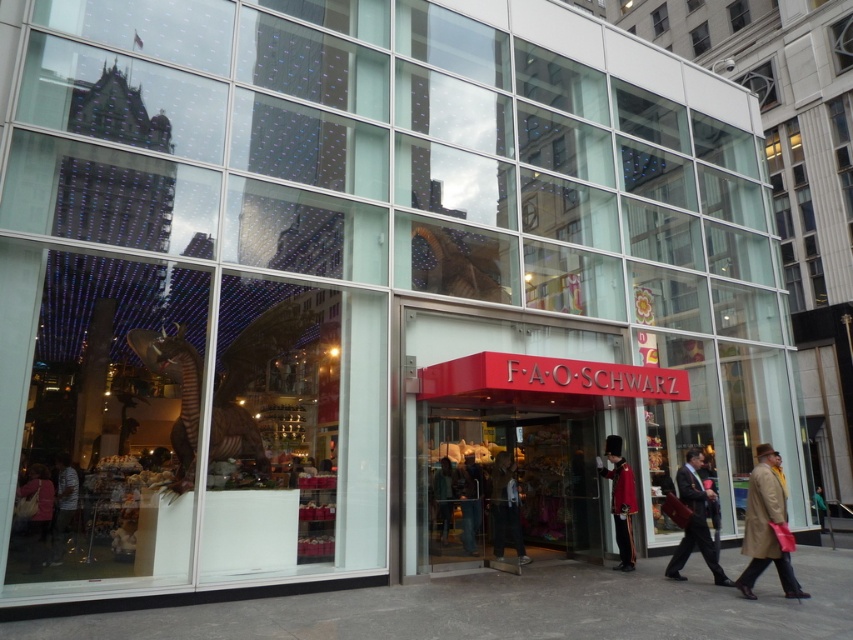
Question: Can you confirm if brown leather coat at lower right is positioned above green fabric coat at center?

Choices:
 (A) no
 (B) yes

Answer: (B)

Question: Which of these objects is positioned farthest from the denim jeans at center?

Choices:
 (A) dark brown leather coat at lower right
 (B) shiny red uniform at center
 (C) green fabric coat at center

Answer: (A)

Question: Can you confirm if striped shirt at lower left is bigger than green fabric coat at center?

Choices:
 (A) yes
 (B) no

Answer: (A)

Question: Does dark brown leather coat at lower right have a smaller size compared to dark gray suit at center?

Choices:
 (A) no
 (B) yes

Answer: (A)

Question: Which of the following is the farthest from the observer?

Choices:
 (A) green fabric coat at center
 (B) denim jeans at center
 (C) dark gray suit at center

Answer: (A)

Question: Which object appears farthest from the camera in this image?

Choices:
 (A) striped shirt at lower left
 (B) green fabric coat at center

Answer: (B)